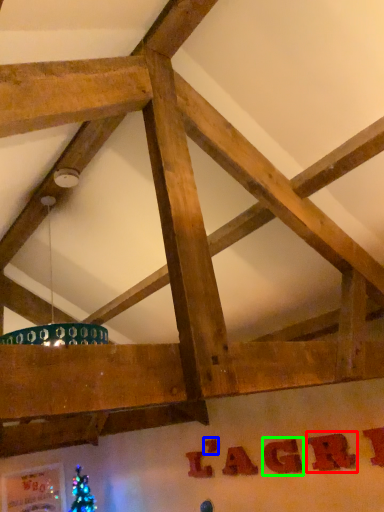
Question: Estimate the real-world distances between objects in this image. Which object is closer to letter (highlighted by a red box), letter (highlighted by a blue box) or letter (highlighted by a green box)?

Choices:
 (A) letter
 (B) letter

Answer: (B)